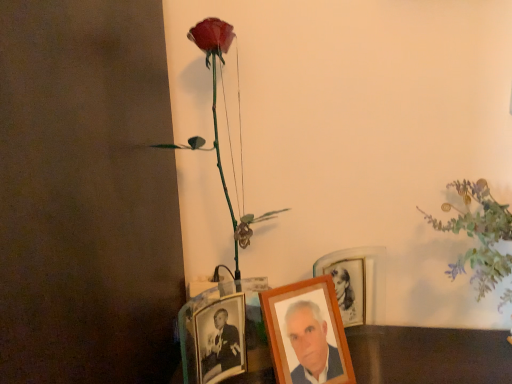
Question: Is wooden photo frame at center, which appears as the 1th picture frame when viewed from the right, shorter than metallic photo frame at lower center, placed as the third picture frame when sorted from right to left?

Choices:
 (A) no
 (B) yes

Answer: (B)

Question: Can you confirm if wooden photo frame at center, the third picture frame when ordered from left to right, is taller than metallic photo frame at lower center, positioned as the 1th picture frame in left-to-right order?

Choices:
 (A) yes
 (B) no

Answer: (B)

Question: From the image's perspective, is wooden photo frame at center, the third picture frame when ordered from left to right, above metallic photo frame at lower center, placed as the third picture frame when sorted from right to left?

Choices:
 (A) no
 (B) yes

Answer: (B)

Question: Does wooden photo frame at center, the third picture frame when ordered from left to right, have a greater width compared to metallic photo frame at lower center, placed as the third picture frame when sorted from right to left?

Choices:
 (A) no
 (B) yes

Answer: (A)

Question: Is the position of wooden photo frame at center, the third picture frame when ordered from left to right, more distant than that of metallic photo frame at lower center, placed as the third picture frame when sorted from right to left?

Choices:
 (A) no
 (B) yes

Answer: (B)

Question: Can you confirm if wooden photo frame at center, the third picture frame when ordered from left to right, is thinner than metallic photo frame at lower center, positioned as the 1th picture frame in left-to-right order?

Choices:
 (A) no
 (B) yes

Answer: (B)

Question: Can you confirm if metallic photo frame at lower center, positioned as the 1th picture frame in left-to-right order, is wider than shiny plastic rose at upper left, the second floral arrangement when ordered from right to left?

Choices:
 (A) yes
 (B) no

Answer: (B)

Question: Is metallic photo frame at lower center, positioned as the 1th picture frame in left-to-right order, positioned in front of shiny plastic rose at upper left, positioned as the first floral arrangement in left-to-right order?

Choices:
 (A) no
 (B) yes

Answer: (B)

Question: Considering the relative positions of metallic photo frame at lower center, placed as the third picture frame when sorted from right to left, and shiny plastic rose at upper left, the second floral arrangement when ordered from right to left, in the image provided, is metallic photo frame at lower center, placed as the third picture frame when sorted from right to left, to the left of shiny plastic rose at upper left, the second floral arrangement when ordered from right to left, from the viewer's perspective?

Choices:
 (A) no
 (B) yes

Answer: (A)

Question: Is metallic photo frame at lower center, positioned as the 1th picture frame in left-to-right order, facing away from shiny plastic rose at upper left, the second floral arrangement when ordered from right to left?

Choices:
 (A) no
 (B) yes

Answer: (B)

Question: Could you tell me if metallic photo frame at lower center, positioned as the 1th picture frame in left-to-right order, is facing shiny plastic rose at upper left, positioned as the first floral arrangement in left-to-right order?

Choices:
 (A) no
 (B) yes

Answer: (A)

Question: From a real-world perspective, does metallic photo frame at lower center, placed as the third picture frame when sorted from right to left, stand above shiny plastic rose at upper left, positioned as the first floral arrangement in left-to-right order?

Choices:
 (A) no
 (B) yes

Answer: (A)

Question: Is metallic photo frame at lower center, placed as the third picture frame when sorted from right to left, facing away from wooden photo frame at center, the 2th picture frame in the left-to-right sequence?

Choices:
 (A) no
 (B) yes

Answer: (A)